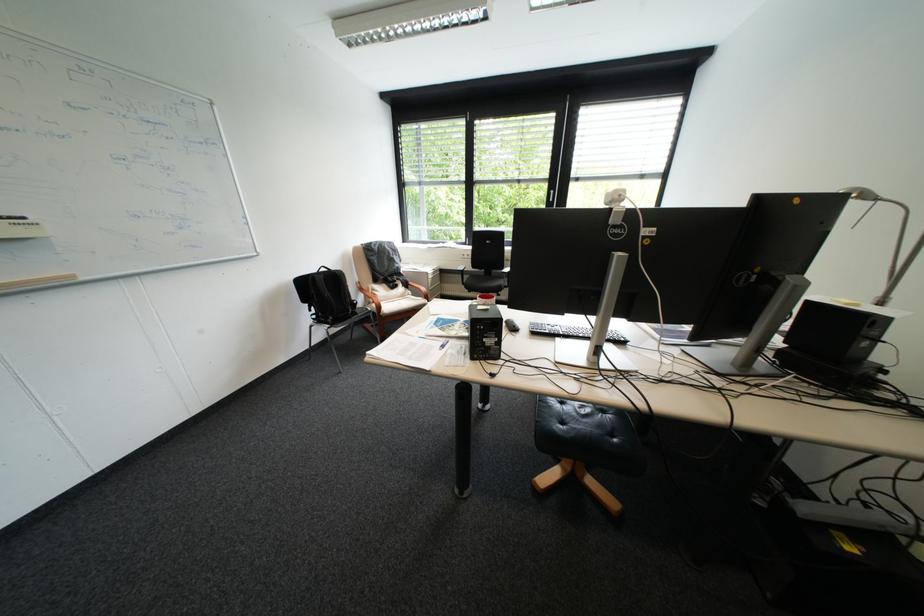
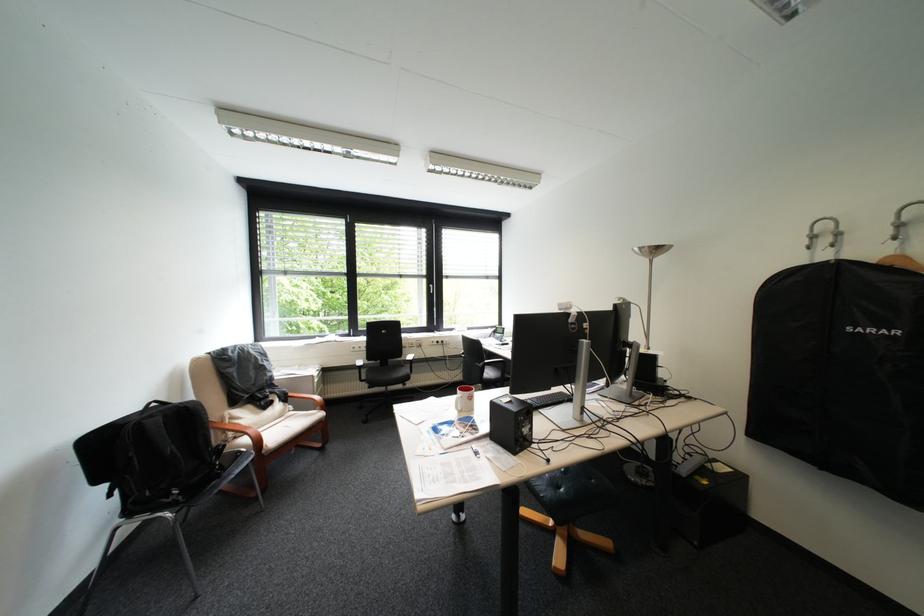
Where in the second image is the point corresponding to (367,301) from the first image?

(231, 445)